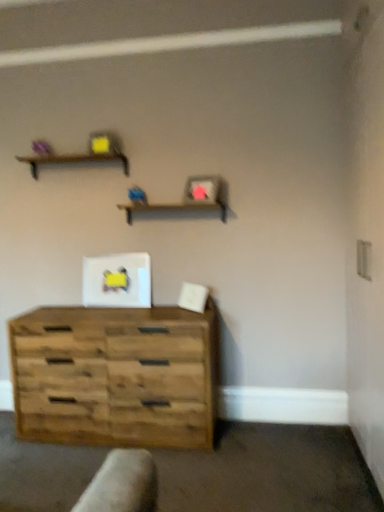
Where is `rustic wood chest of drawers at lower left`? This screenshot has height=512, width=384. rustic wood chest of drawers at lower left is located at coordinates (115, 376).

Is wooden shelf at center, acting as the second shelf starting from the top, aimed at rustic wood chest of drawers at lower left?

No, wooden shelf at center, acting as the second shelf starting from the top, is not facing towards rustic wood chest of drawers at lower left.

Considering the relative sizes of wooden shelf at center, which is counted as the 1th shelf, starting from the right, and rustic wood chest of drawers at lower left in the image provided, is wooden shelf at center, which is counted as the 1th shelf, starting from the right, wider than rustic wood chest of drawers at lower left?

Incorrect, the width of wooden shelf at center, which is counted as the 1th shelf, starting from the right, does not surpass that of rustic wood chest of drawers at lower left.

Consider the image. Does wooden shelf at center, acting as the second shelf starting from the top, have a lesser height compared to rustic wood chest of drawers at lower left?

Yes, wooden shelf at center, acting as the second shelf starting from the top, is shorter than rustic wood chest of drawers at lower left.

Does wooden shelf at center, which appears as the 2th shelf when viewed from the left, appear on the left side of rustic wood chest of drawers at lower left?

Incorrect, wooden shelf at center, which appears as the 2th shelf when viewed from the left, is not on the left side of rustic wood chest of drawers at lower left.

Does rustic wood chest of drawers at lower left lie in front of brown wooden shelf at upper center, the 2th shelf from the right?

Yes, rustic wood chest of drawers at lower left is in front of brown wooden shelf at upper center, the 2th shelf from the right.

Consider the image. From the image's perspective, is rustic wood chest of drawers at lower left located beneath brown wooden shelf at upper center, the 1th shelf in the top-to-bottom sequence?

Correct, rustic wood chest of drawers at lower left appears lower than brown wooden shelf at upper center, the 1th shelf in the top-to-bottom sequence, in the image.

Is brown wooden shelf at upper center, the 2th shelf ordered from the bottom, at the back of rustic wood chest of drawers at lower left?

No, brown wooden shelf at upper center, the 2th shelf ordered from the bottom, is not at the back of rustic wood chest of drawers at lower left.

Does rustic wood chest of drawers at lower left have a greater height compared to brown wooden shelf at upper center, the 1th shelf in the top-to-bottom sequence?

Yes.

Does point (99, 159) appear closer or farther from the camera than point (160, 205)?

Point (99, 159).

Which is more to the right, brown wooden shelf at upper center, the 2th shelf ordered from the bottom, or wooden shelf at center, which is counted as the 1th shelf, starting from the bottom?

wooden shelf at center, which is counted as the 1th shelf, starting from the bottom, is more to the right.

Considering the relative sizes of brown wooden shelf at upper center, the 1th shelf in the top-to-bottom sequence, and wooden shelf at center, which is counted as the 1th shelf, starting from the right, in the image provided, is brown wooden shelf at upper center, the 1th shelf in the top-to-bottom sequence, thinner than wooden shelf at center, which is counted as the 1th shelf, starting from the right,?

Indeed, brown wooden shelf at upper center, the 1th shelf in the top-to-bottom sequence, has a lesser width compared to wooden shelf at center, which is counted as the 1th shelf, starting from the right.

Is brown wooden shelf at upper center, the 2th shelf ordered from the bottom, aimed at wooden shelf at center, which is counted as the 1th shelf, starting from the right?

No, brown wooden shelf at upper center, the 2th shelf ordered from the bottom, is not facing towards wooden shelf at center, which is counted as the 1th shelf, starting from the right.

From the image's perspective, between wooden shelf at center, acting as the second shelf starting from the top, and brown wooden shelf at upper center, the 2th shelf ordered from the bottom, who is located below?

wooden shelf at center, acting as the second shelf starting from the top, from the image's perspective.

Considering the relative sizes of wooden shelf at center, which is counted as the 1th shelf, starting from the bottom, and brown wooden shelf at upper center, the 2th shelf ordered from the bottom, in the image provided, is wooden shelf at center, which is counted as the 1th shelf, starting from the bottom, shorter than brown wooden shelf at upper center, the 2th shelf ordered from the bottom,?

No, wooden shelf at center, which is counted as the 1th shelf, starting from the bottom, is not shorter than brown wooden shelf at upper center, the 2th shelf ordered from the bottom.

Is brown wooden shelf at upper center, the 2th shelf from the right, surrounded by wooden shelf at center, which appears as the 2th shelf when viewed from the left?

No, brown wooden shelf at upper center, the 2th shelf from the right, is not surrounded by wooden shelf at center, which appears as the 2th shelf when viewed from the left.

Does wooden shelf at center, acting as the second shelf starting from the top, have a lesser width compared to brown wooden shelf at upper center, the 2th shelf from the right?

No, wooden shelf at center, acting as the second shelf starting from the top, is not thinner than brown wooden shelf at upper center, the 2th shelf from the right.

Considering the relative sizes of rustic wood chest of drawers at lower left and wooden shelf at center, which is counted as the 1th shelf, starting from the bottom, in the image provided, is rustic wood chest of drawers at lower left thinner than wooden shelf at center, which is counted as the 1th shelf, starting from the bottom,?

No, rustic wood chest of drawers at lower left is not thinner than wooden shelf at center, which is counted as the 1th shelf, starting from the bottom.

Which object is positioned more to the right, rustic wood chest of drawers at lower left or wooden shelf at center, which appears as the 2th shelf when viewed from the left?

wooden shelf at center, which appears as the 2th shelf when viewed from the left.

Is rustic wood chest of drawers at lower left facing towards wooden shelf at center, acting as the second shelf starting from the top?

No.

Is rustic wood chest of drawers at lower left shorter than wooden shelf at center, which appears as the 2th shelf when viewed from the left?

No, rustic wood chest of drawers at lower left is not shorter than wooden shelf at center, which appears as the 2th shelf when viewed from the left.

Which object is wider, brown wooden shelf at upper center, the 1th shelf in the top-to-bottom sequence, or rustic wood chest of drawers at lower left?

Wider between the two is rustic wood chest of drawers at lower left.

What's the angular difference between brown wooden shelf at upper center, the 2th shelf ordered from the bottom, and rustic wood chest of drawers at lower left's facing directions?

The angular difference between brown wooden shelf at upper center, the 2th shelf ordered from the bottom, and rustic wood chest of drawers at lower left is 0.337 degrees.

Can you confirm if brown wooden shelf at upper center, the 2th shelf ordered from the bottom, is taller than rustic wood chest of drawers at lower left?

In fact, brown wooden shelf at upper center, the 2th shelf ordered from the bottom, may be shorter than rustic wood chest of drawers at lower left.

Who is bigger, brown wooden shelf at upper center, the 1th shelf viewed from the left, or rustic wood chest of drawers at lower left?

Bigger between the two is rustic wood chest of drawers at lower left.

I want to click on the 1st shelf above the rustic wood chest of drawers at lower left (from a real-world perspective), so click(173, 209).

At what (x,y) coordinates should I click in order to perform the action: click on chest of drawers in front of the brown wooden shelf at upper center, the 1th shelf viewed from the left. Please return your answer as a coordinate pair (x, y). Image resolution: width=384 pixels, height=512 pixels. Looking at the image, I should click on (115, 376).

Based on their spatial positions, is brown wooden shelf at upper center, the 1th shelf in the top-to-bottom sequence, or rustic wood chest of drawers at lower left closer to wooden shelf at center, which is counted as the 1th shelf, starting from the bottom?

The object closer to wooden shelf at center, which is counted as the 1th shelf, starting from the bottom, is brown wooden shelf at upper center, the 1th shelf in the top-to-bottom sequence.

Which object lies nearer to the anchor point rustic wood chest of drawers at lower left, wooden shelf at center, which is counted as the 1th shelf, starting from the right, or brown wooden shelf at upper center, the 2th shelf ordered from the bottom?

Among the two, wooden shelf at center, which is counted as the 1th shelf, starting from the right, is located nearer to rustic wood chest of drawers at lower left.

Looking at this image, based on their spatial positions, is brown wooden shelf at upper center, the 1th shelf in the top-to-bottom sequence, or wooden shelf at center, which is counted as the 1th shelf, starting from the right, further from rustic wood chest of drawers at lower left?

brown wooden shelf at upper center, the 1th shelf in the top-to-bottom sequence, lies further to rustic wood chest of drawers at lower left than the other object.

When comparing their distances from brown wooden shelf at upper center, the 1th shelf viewed from the left, does rustic wood chest of drawers at lower left or wooden shelf at center, acting as the second shelf starting from the top, seem further?

Based on the image, rustic wood chest of drawers at lower left appears to be further to brown wooden shelf at upper center, the 1th shelf viewed from the left.

From the image, which object appears to be nearer to brown wooden shelf at upper center, the 1th shelf in the top-to-bottom sequence, wooden shelf at center, which is counted as the 1th shelf, starting from the bottom, or rustic wood chest of drawers at lower left?

wooden shelf at center, which is counted as the 1th shelf, starting from the bottom, is positioned closer to the anchor brown wooden shelf at upper center, the 1th shelf in the top-to-bottom sequence.

Which object lies further to the anchor point wooden shelf at center, acting as the second shelf starting from the top, rustic wood chest of drawers at lower left or brown wooden shelf at upper center, the 1th shelf viewed from the left?

rustic wood chest of drawers at lower left lies further to wooden shelf at center, acting as the second shelf starting from the top, than the other object.

I want to click on shelf between brown wooden shelf at upper center, the 1th shelf in the top-to-bottom sequence, and rustic wood chest of drawers at lower left, in the vertical direction, so click(x=173, y=209).